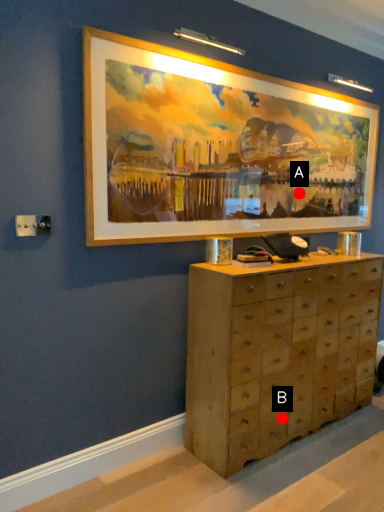
Question: Two points are circled on the image, labeled by A and B beside each circle. Which of the following is the closest to the observer?

Choices:
 (A) A is closer
 (B) B is closer

Answer: (B)